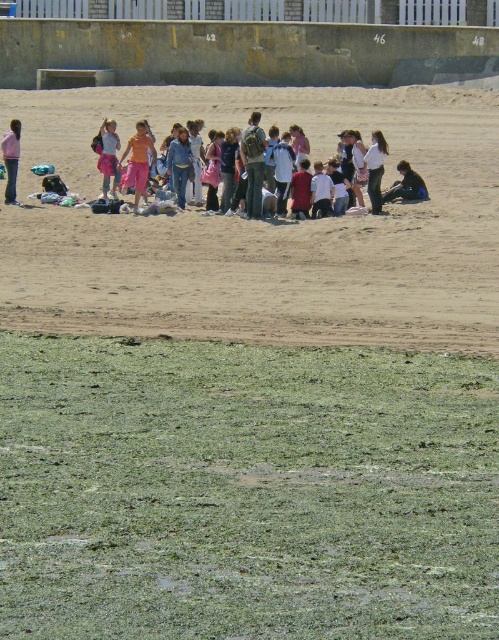
Is pink fabric pants at center thinner than matte pink shirt at left?

Indeed, pink fabric pants at center has a lesser width compared to matte pink shirt at left.

The image size is (499, 640). What are the coordinates of `pink fabric pants at center` in the screenshot? It's located at (107, 156).

Who is positioned more to the left, white matte shirt at center or matte pink shirt at left?

matte pink shirt at left is more to the left.

Can you confirm if white matte shirt at center is thinner than matte pink shirt at left?

Yes, white matte shirt at center is thinner than matte pink shirt at left.

Is point (371, 157) less distant than point (12, 124)?

Yes, it is.

The image size is (499, 640). In order to click on white matte shirt at center in this screenshot , I will do `click(376, 170)`.

Is brown sandy beach at center positioned in front of dark blue shirt at center?

Yes, it is.

Does brown sandy beach at center appear over dark blue shirt at center?

Correct, brown sandy beach at center is located above dark blue shirt at center.

Does point (262, 109) come behind point (426, 198)?

That is True.

Locate an element on the screen. brown sandy beach at center is located at coordinates pos(263,228).